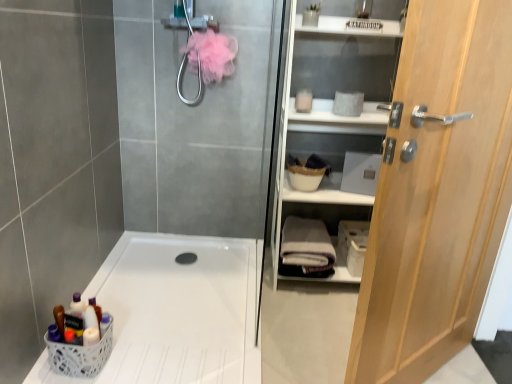
Question: Is white plastic bath at lower left facing towards light wood door at right?

Choices:
 (A) no
 (B) yes

Answer: (A)

Question: Does white plastic bath at lower left lie behind light wood door at right?

Choices:
 (A) yes
 (B) no

Answer: (A)

Question: Considering the relative sizes of white plastic bath at lower left and light wood door at right in the image provided, is white plastic bath at lower left shorter than light wood door at right?

Choices:
 (A) no
 (B) yes

Answer: (B)

Question: Considering the relative sizes of white plastic bath at lower left and light wood door at right in the image provided, is white plastic bath at lower left bigger than light wood door at right?

Choices:
 (A) yes
 (B) no

Answer: (B)

Question: From the image's perspective, is white plastic bath at lower left located above light wood door at right?

Choices:
 (A) yes
 (B) no

Answer: (B)

Question: Would you say white plastic bath at lower left is a long distance from light wood door at right?

Choices:
 (A) yes
 (B) no

Answer: (B)

Question: Considering the relative sizes of white cotton bath towel at center and white matte shelf at right in the image provided, is white cotton bath towel at center wider than white matte shelf at right?

Choices:
 (A) yes
 (B) no

Answer: (A)

Question: From a real-world perspective, is white cotton bath towel at center positioned under white matte shelf at right based on gravity?

Choices:
 (A) no
 (B) yes

Answer: (B)

Question: Does white cotton bath towel at center have a greater height compared to white matte shelf at right?

Choices:
 (A) yes
 (B) no

Answer: (B)

Question: From the image's perspective, is white cotton bath towel at center below white matte shelf at right?

Choices:
 (A) no
 (B) yes

Answer: (B)

Question: Does white cotton bath towel at center lie in front of white matte shelf at right?

Choices:
 (A) yes
 (B) no

Answer: (B)

Question: Is white cotton bath towel at center directly adjacent to white matte shelf at right?

Choices:
 (A) no
 (B) yes

Answer: (A)

Question: Can you confirm if white matte shelf at right is shorter than white plastic bath at lower left?

Choices:
 (A) yes
 (B) no

Answer: (B)